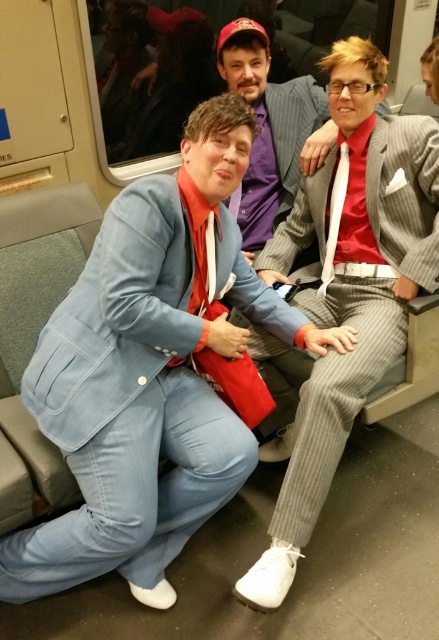
You are a photographer trying to capture a candid shot of the light blue denim suit at center and the gray pinstripe suit at right. Since you want to include both in the frame, which direction should you position your camera relative to the two suits?

You should position your camera to the left of the light blue denim suit at center and gray pinstripe suit at right because the light blue denim suit at center is on the left side of the gray pinstripe suit at right.

You are standing in the subway car and want to pass between the gray pinstripe suit at right and the striped suit at center. Based on their positions, do you think there is enough space to walk through?

The gray pinstripe suit at right is wider than the striped suit at center, so there might not be enough space to walk through comfortably between them.

You are standing in the subway car and want to ask a question to the person in the light blue denim suit at center and the person in the striped suit at center. Which one is closer to you?

The light blue denim suit at center is closer to you because it is in front of the striped suit at center.